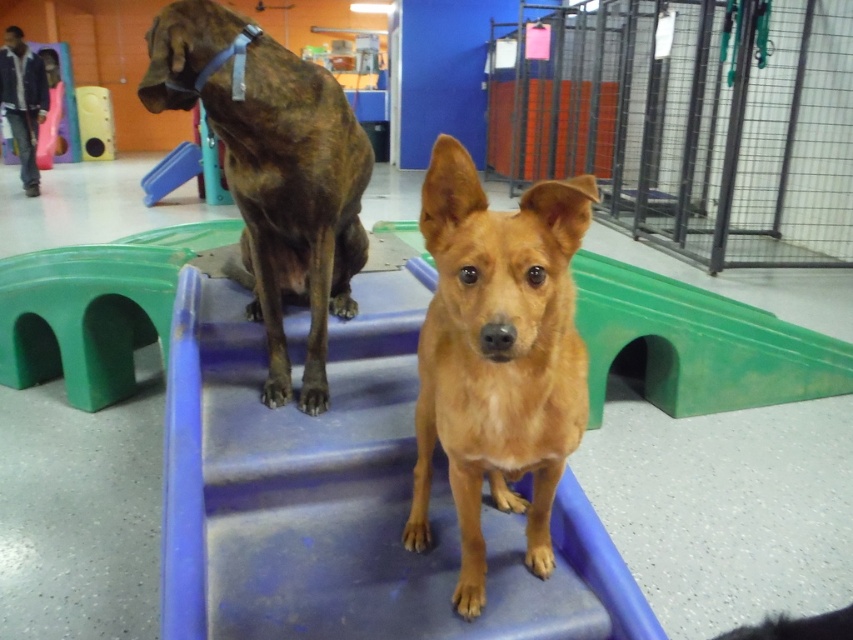
Question: Is brown furry dog at center smaller than blue denim jacket at upper left?

Choices:
 (A) no
 (B) yes

Answer: (B)

Question: Can you confirm if brown furry dog at center is positioned to the right of brown brindle dog at upper left?

Choices:
 (A) yes
 (B) no

Answer: (A)

Question: Which object is the closest to the brown furry dog at center?

Choices:
 (A) metallic wire cage at center right
 (B) blue plastic slide at upper center
 (C) blue plastic stairs at center
 (D) brown brindle dog at upper left

Answer: (C)

Question: Among these points, which one is farthest from the camera?

Choices:
 (A) (15, 144)
 (B) (193, 96)
 (C) (463, 522)

Answer: (A)

Question: Which object is the farthest from the brown furry dog at center?

Choices:
 (A) blue plastic stairs at center
 (B) blue plastic slide at upper center
 (C) metallic wire cage at center right

Answer: (B)

Question: Is brown furry dog at center closer to the viewer compared to brown brindle dog at upper left?

Choices:
 (A) no
 (B) yes

Answer: (B)